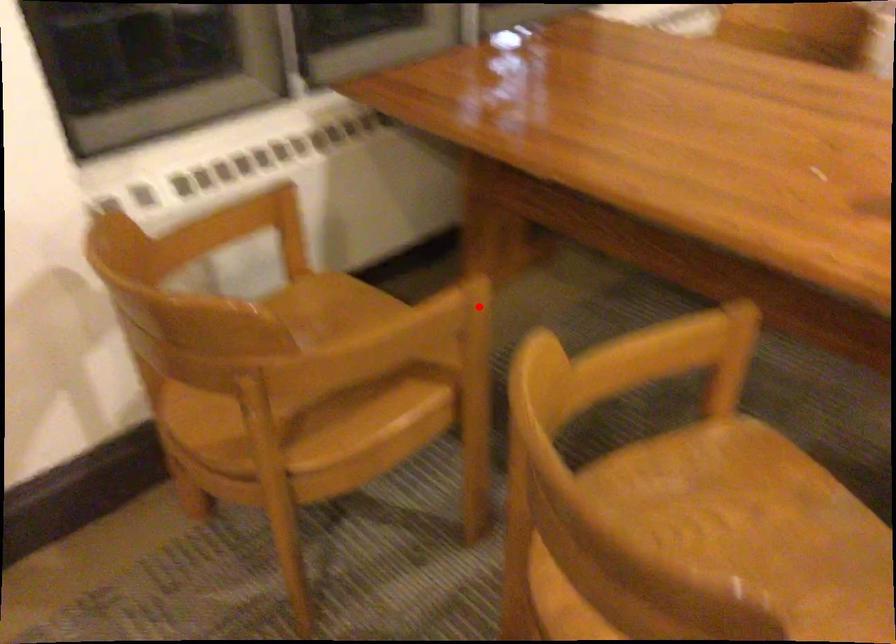
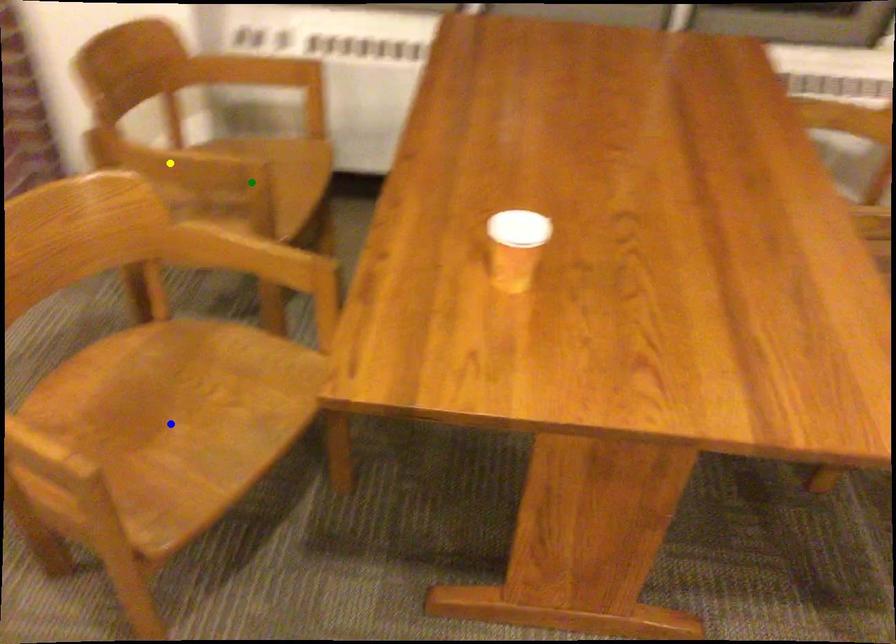
Question: I am providing you with two images of the same scene from different viewpoints. A red point is marked on the first image. You are given multiple points on the second image. Which mark in image 2 goes with the point in image 1?

Choices:
 (A) blue point
 (B) green point
 (C) yellow point

Answer: (B)